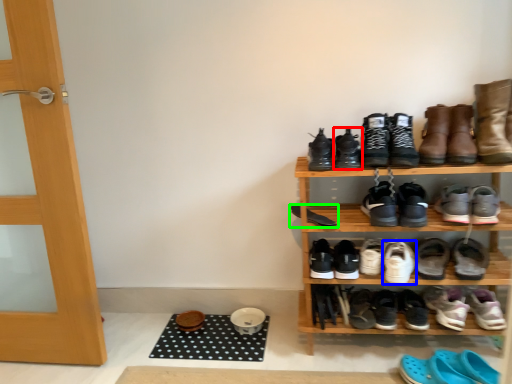
Question: Which object is positioned farthest from footwear (highlighted by a red box)? Select from footwear (highlighted by a blue box) and footwear (highlighted by a green box).

Choices:
 (A) footwear
 (B) footwear

Answer: (A)